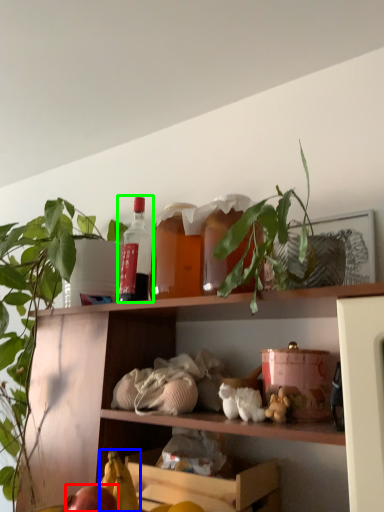
Question: Which object is positioned farthest from apple (highlighted by a red box)? Select from banana (highlighted by a blue box) and bottle (highlighted by a green box).

Choices:
 (A) banana
 (B) bottle

Answer: (B)